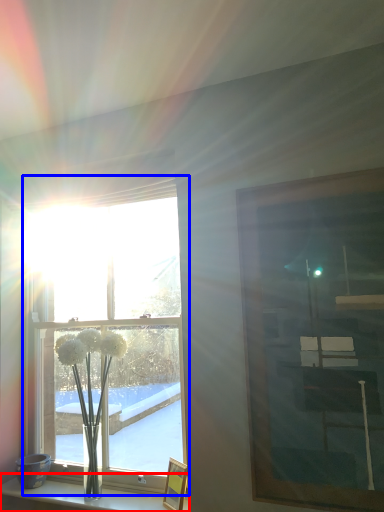
Question: Which of the following is the closest to the observer, shelf (highlighted by a red box) or window (highlighted by a blue box)?

Choices:
 (A) shelf
 (B) window

Answer: (A)